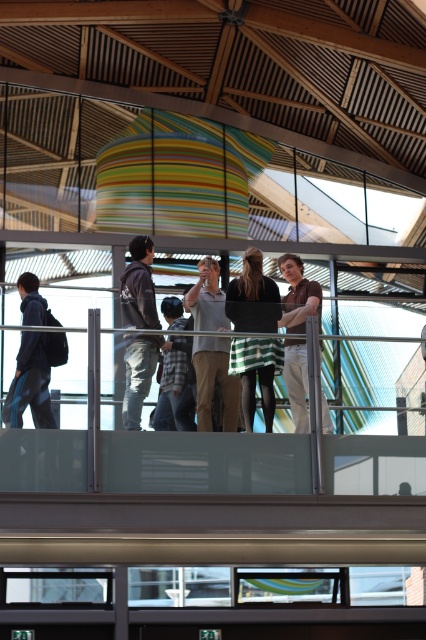
The width and height of the screenshot is (426, 640). What do you see at coordinates (253, 298) in the screenshot?
I see `green striped dress at center` at bounding box center [253, 298].

Does green striped dress at center appear under matte black backpack at left?

Actually, green striped dress at center is above matte black backpack at left.

You are a GUI agent. You are given a task and a screenshot of the screen. Output one action in this format:
    pyautogui.click(x=<x>, y=<y>)
    Task: Click on the green striped dress at center
    
    Given the screenshot: What is the action you would take?
    pyautogui.click(x=253, y=298)

Does light gray cotton shirt at center come behind brown cotton shirt at center?

No.

Based on the photo, can you confirm if light gray cotton shirt at center is smaller than brown cotton shirt at center?

Actually, light gray cotton shirt at center might be larger than brown cotton shirt at center.

Is point (190, 301) in front of point (307, 308)?

Yes.

You are a GUI agent. You are given a task and a screenshot of the screen. Output one action in this format:
    pyautogui.click(x=<x>, y=<y>)
    Task: Click on the light gray cotton shirt at center
    The height and width of the screenshot is (640, 426).
    Given the screenshot: What is the action you would take?
    pyautogui.click(x=213, y=381)

Is point (253, 412) farther from viewer compared to point (184, 320)?

No, it is not.

Which is in front, point (259, 368) or point (158, 404)?

Point (158, 404) is in front.

Who is more forward, (x=256, y=323) or (x=178, y=403)?

Positioned in front is point (x=178, y=403).

Image resolution: width=426 pixels, height=640 pixels. Identify the location of green striped dress at center. (253, 298).